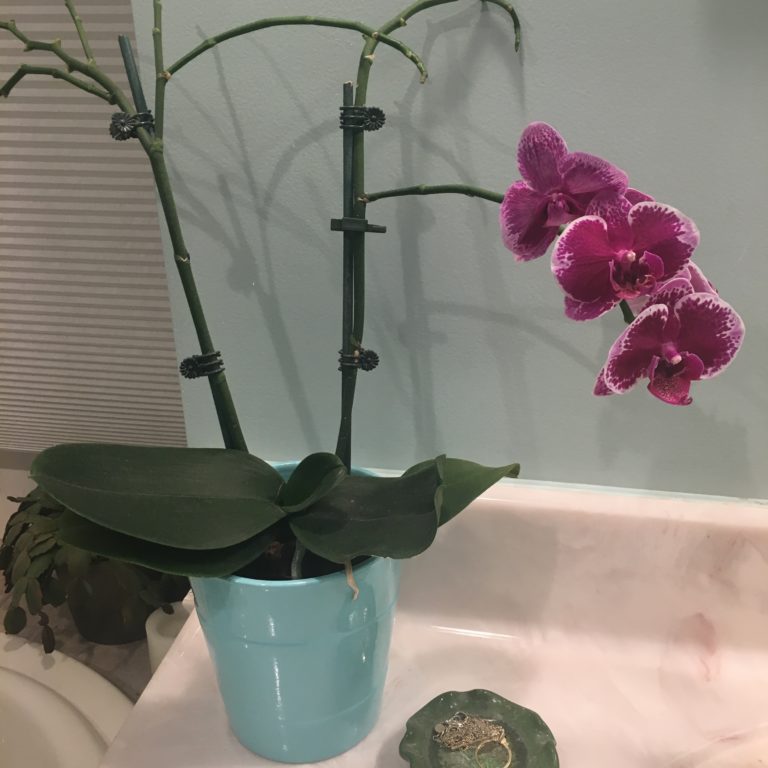
Locate an element on the screen. Image resolution: width=768 pixels, height=768 pixels. purple and white orchid is located at coordinates (730, 326).